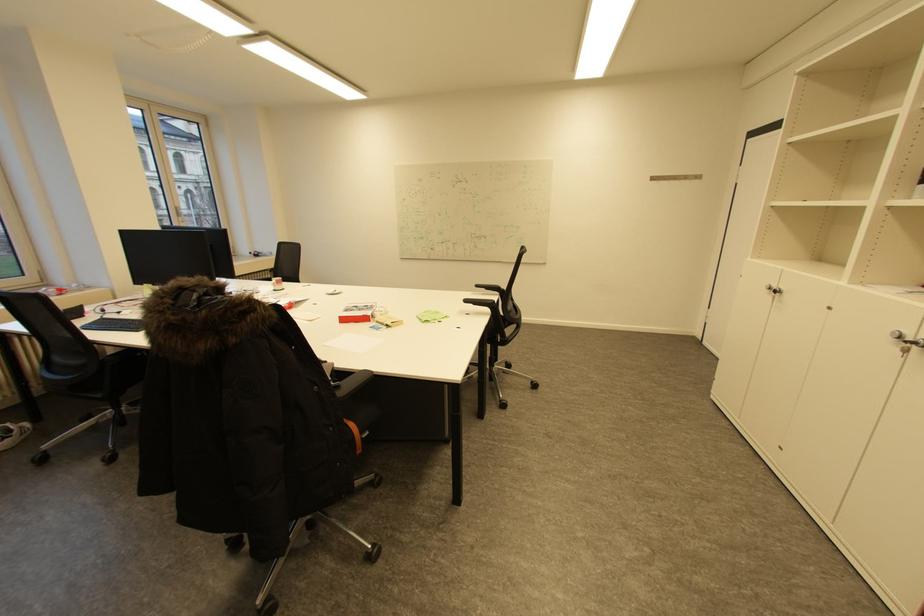
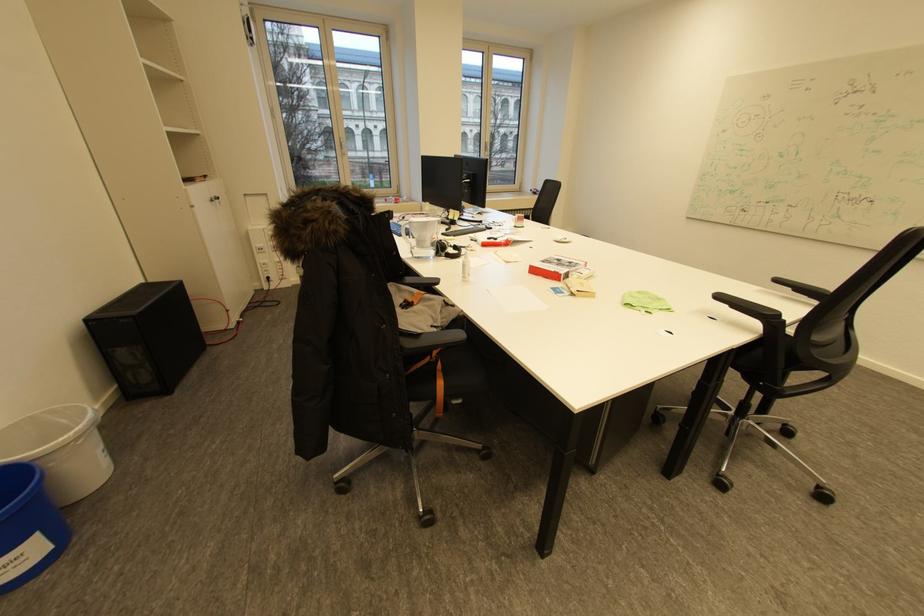
Question: The camera is either moving clockwise (left) or counter-clockwise (right) around the object. The first image is from the beginning of the video and the second image is from the end. Is the camera moving left or right when shooting the video?

Choices:
 (A) Left
 (B) Right

Answer: (B)